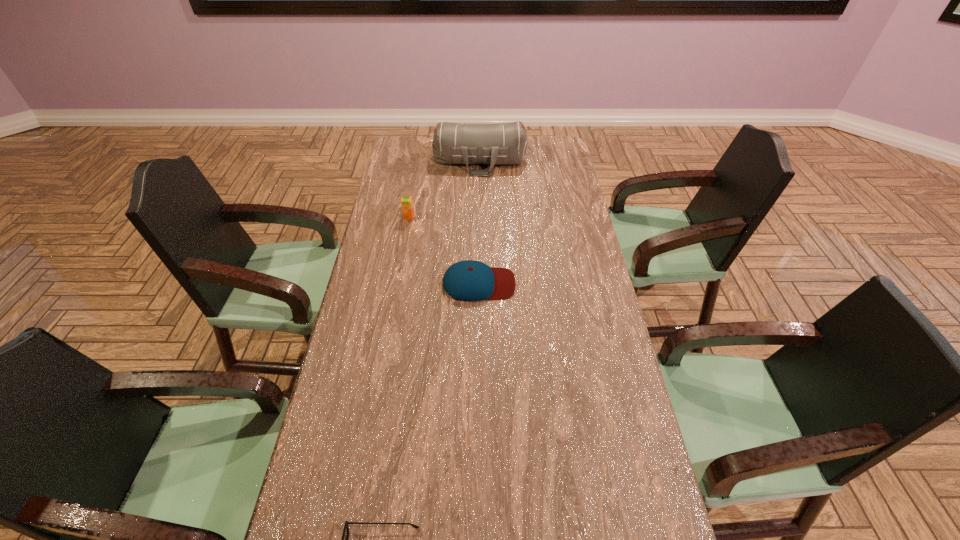
You are a GUI agent. You are given a task and a screenshot of the screen. Output one action in this format:
    pyautogui.click(x=<x>, y=<y>)
    Task: Click on the farthest object
    The height and width of the screenshot is (540, 960).
    Given the screenshot: What is the action you would take?
    pyautogui.click(x=453, y=143)

At what (x,y) coordinates should I click in order to perform the action: click on the tallest object. Please return your answer as a coordinate pair (x, y). Image resolution: width=960 pixels, height=540 pixels. Looking at the image, I should click on (453, 143).

Find the location of a particular element. Image resolution: width=960 pixels, height=540 pixels. the third nearest object is located at coordinates (406, 202).

This screenshot has width=960, height=540. Find the location of `orange juice`. orange juice is located at coordinates (406, 202).

Where is `the third tallest object`? The width and height of the screenshot is (960, 540). the third tallest object is located at coordinates (469, 280).

You are a GUI agent. You are given a task and a screenshot of the screen. Output one action in this format:
    pyautogui.click(x=<x>, y=<y>)
    Task: Click on the baseball cap
    The height and width of the screenshot is (540, 960).
    Given the screenshot: What is the action you would take?
    [469, 280]

This screenshot has height=540, width=960. Find the location of `vacant space situated 0.250m on the front of the farthest object`. vacant space situated 0.250m on the front of the farthest object is located at coordinates (480, 212).

Where is `free space located on the right of the third shortest object`? The image size is (960, 540). free space located on the right of the third shortest object is located at coordinates (515, 217).

Locate an element on the screen. The width and height of the screenshot is (960, 540). blank space located 0.240m with the bill of the second nearest object facing forward is located at coordinates (586, 284).

Locate an element on the screen. The image size is (960, 540). object situated at the far edge is located at coordinates (453, 143).